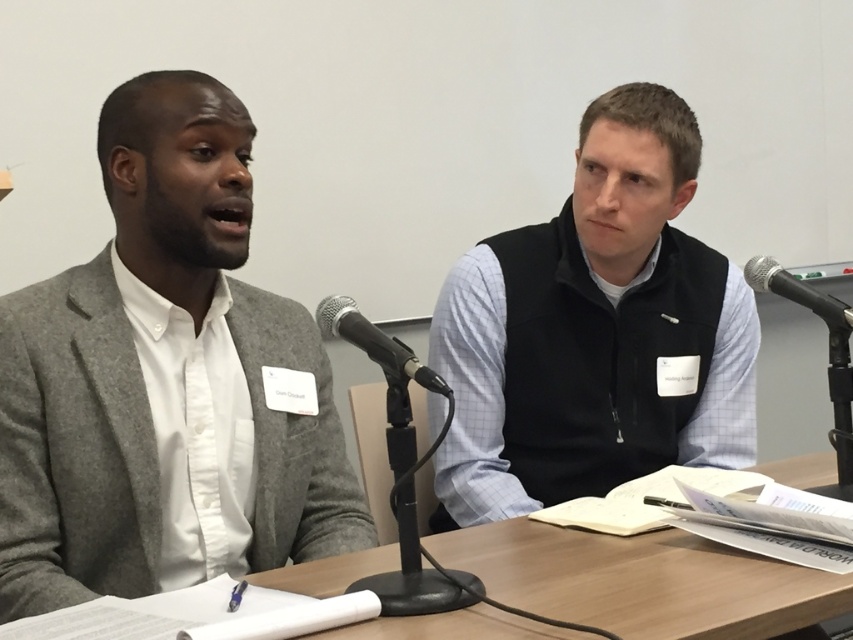
Question: Does wooden table at center appear on the left side of black metallic microphone at upper right?

Choices:
 (A) no
 (B) yes

Answer: (B)

Question: Based on their relative distances, which object is nearer to the black vest at center?

Choices:
 (A) wooden table at center
 (B) black metallic microphone at upper right
 (C) gray woolen blazer at left
 (D) black metallic microphone at center

Answer: (B)

Question: Which object is the closest to the gray woolen blazer at left?

Choices:
 (A) black vest at center
 (B) wooden table at center
 (C) black metallic microphone at upper right

Answer: (B)

Question: Where is gray woolen blazer at left located in relation to black metallic microphone at center in the image?

Choices:
 (A) left
 (B) right

Answer: (A)

Question: Which object appears farthest from the camera in this image?

Choices:
 (A) black metallic microphone at upper right
 (B) gray woolen blazer at left

Answer: (A)

Question: Can you confirm if black vest at center is positioned to the right of wooden table at center?

Choices:
 (A) yes
 (B) no

Answer: (A)